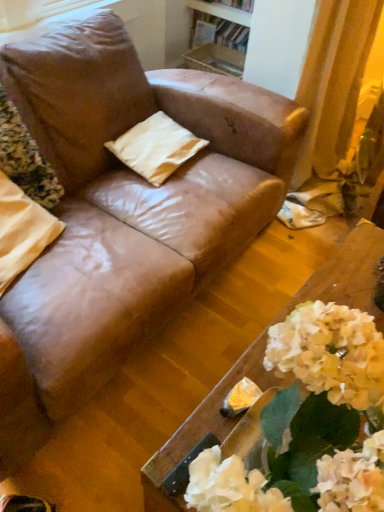
Question: Is wooden bookshelf at upper center bigger than beige fabric pillow at center, placed as the first pillow when sorted from back to front?

Choices:
 (A) no
 (B) yes

Answer: (B)

Question: Considering the relative sizes of wooden bookshelf at upper center and beige fabric pillow at center, the 2th pillow viewed from the front, in the image provided, is wooden bookshelf at upper center smaller than beige fabric pillow at center, the 2th pillow viewed from the front,?

Choices:
 (A) yes
 (B) no

Answer: (B)

Question: From the image's perspective, does wooden bookshelf at upper center appear higher than beige fabric pillow at center, which is the first pillow from right to left?

Choices:
 (A) no
 (B) yes

Answer: (B)

Question: Could you tell me if wooden bookshelf at upper center is facing beige fabric pillow at center, placed as the first pillow when sorted from back to front?

Choices:
 (A) no
 (B) yes

Answer: (B)

Question: From a real-world perspective, is wooden bookshelf at upper center positioned under beige fabric pillow at center, the second pillow when ordered from left to right, based on gravity?

Choices:
 (A) no
 (B) yes

Answer: (B)

Question: Considering the positions of point (226, 68) and point (36, 209), is point (226, 68) closer or farther from the camera than point (36, 209)?

Choices:
 (A) farther
 (B) closer

Answer: (A)

Question: From a real-world perspective, is wooden bookshelf at upper center physically located above or below beige fabric pillow at left, placed as the second pillow when sorted from back to front?

Choices:
 (A) above
 (B) below

Answer: (B)

Question: From their relative heights in the image, would you say wooden bookshelf at upper center is taller or shorter than beige fabric pillow at left, placed as the second pillow when sorted from back to front?

Choices:
 (A) short
 (B) tall

Answer: (A)

Question: From the image's perspective, is wooden bookshelf at upper center positioned above or below beige fabric pillow at left, positioned as the 1th pillow in front-to-back order?

Choices:
 (A) above
 (B) below

Answer: (A)

Question: Considering the positions of point (49, 204) and point (155, 184), is point (49, 204) closer or farther from the camera than point (155, 184)?

Choices:
 (A) farther
 (B) closer

Answer: (B)

Question: Considering the relative positions of matte brown pillow at upper left and beige fabric pillow at center, which is the first pillow from right to left, in the image provided, is matte brown pillow at upper left to the left or to the right of beige fabric pillow at center, which is the first pillow from right to left,?

Choices:
 (A) right
 (B) left

Answer: (B)

Question: From the image's perspective, is matte brown pillow at upper left positioned above or below beige fabric pillow at center, placed as the first pillow when sorted from back to front?

Choices:
 (A) below
 (B) above

Answer: (A)

Question: From a real-world perspective, is matte brown pillow at upper left above or below beige fabric pillow at center, placed as the first pillow when sorted from back to front?

Choices:
 (A) below
 (B) above

Answer: (B)

Question: Is wooden table at lower right to the left or to the right of beige fabric pillow at center, placed as the first pillow when sorted from back to front, in the image?

Choices:
 (A) left
 (B) right

Answer: (B)

Question: From their relative heights in the image, would you say wooden table at lower right is taller or shorter than beige fabric pillow at center, the second pillow when ordered from left to right?

Choices:
 (A) short
 (B) tall

Answer: (B)